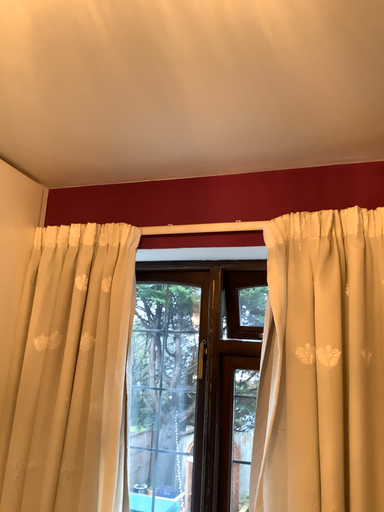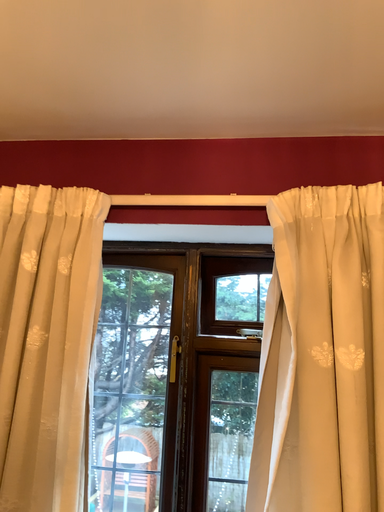
Question: How did the camera likely rotate when shooting the video?

Choices:
 (A) rotated left
 (B) rotated right

Answer: (B)